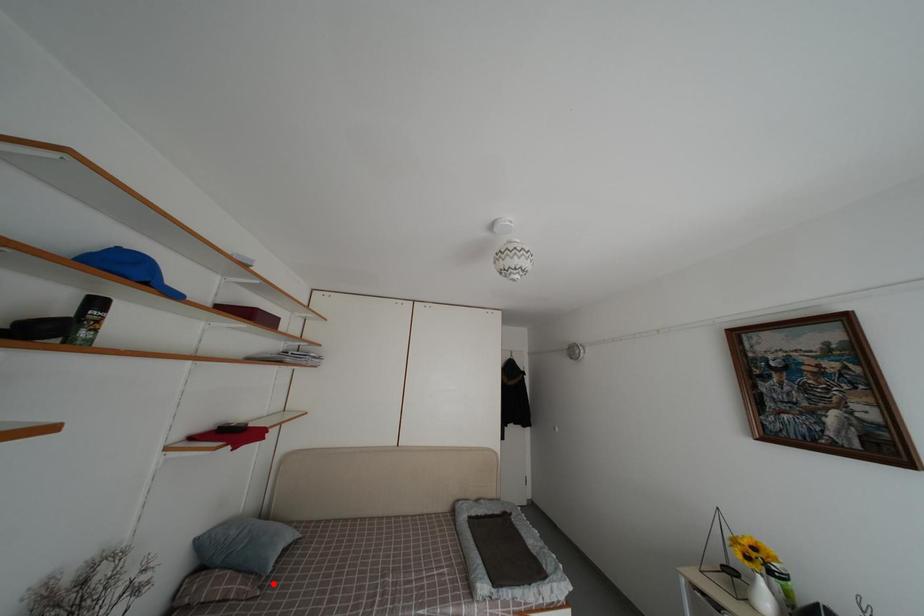
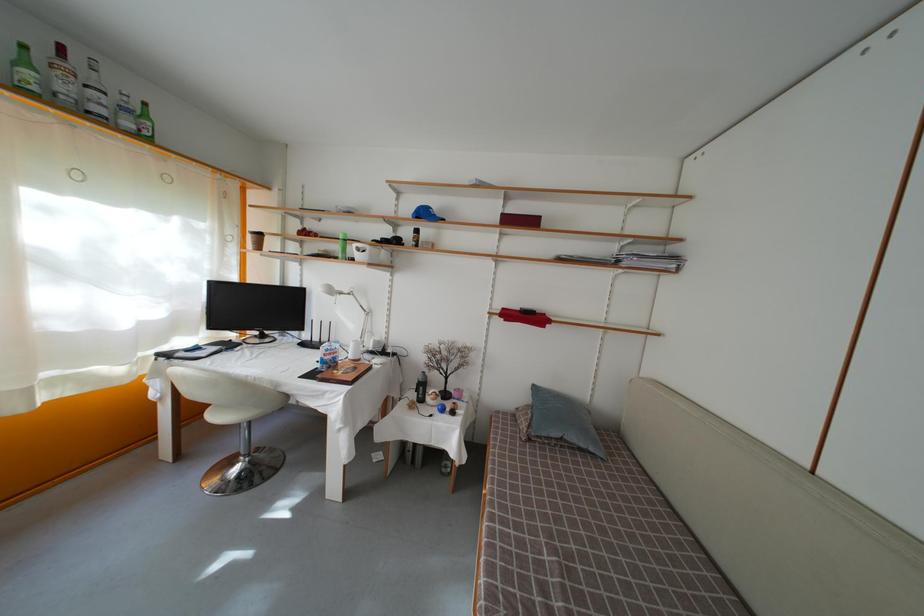
In the second image, find the point that corresponds to the highlighted location in the first image.

(550, 450)